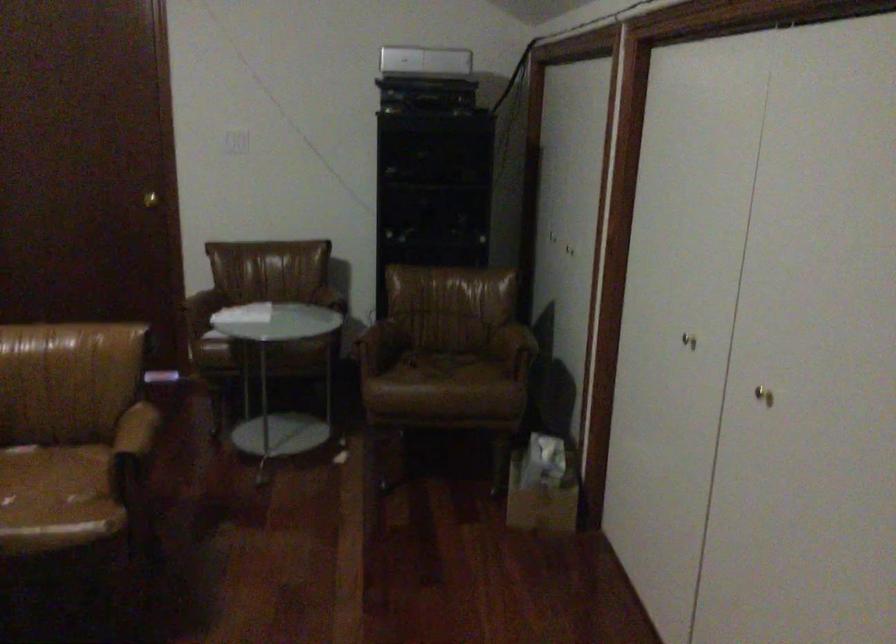
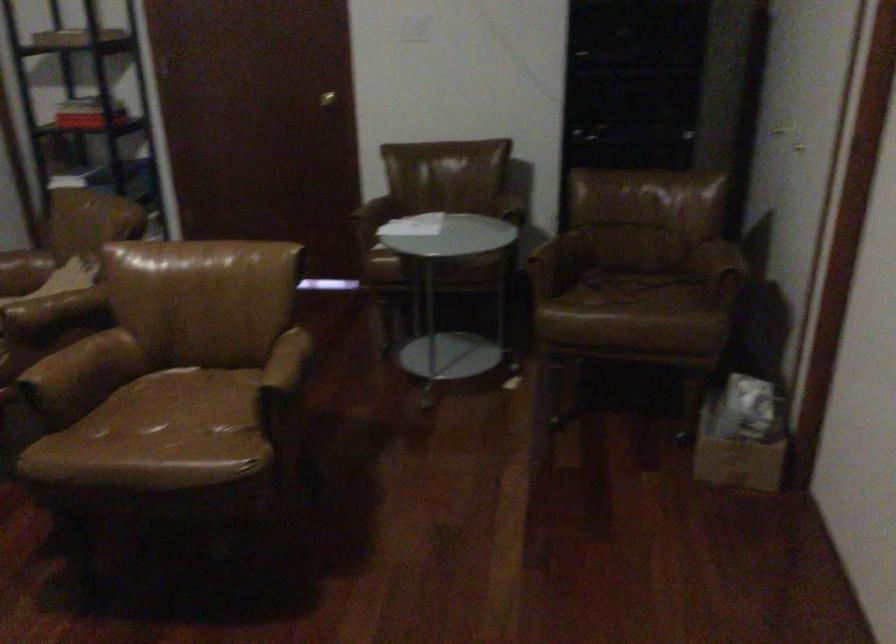
Find the pixel in the second image that matches pixel 136 438 in the first image.

(283, 371)